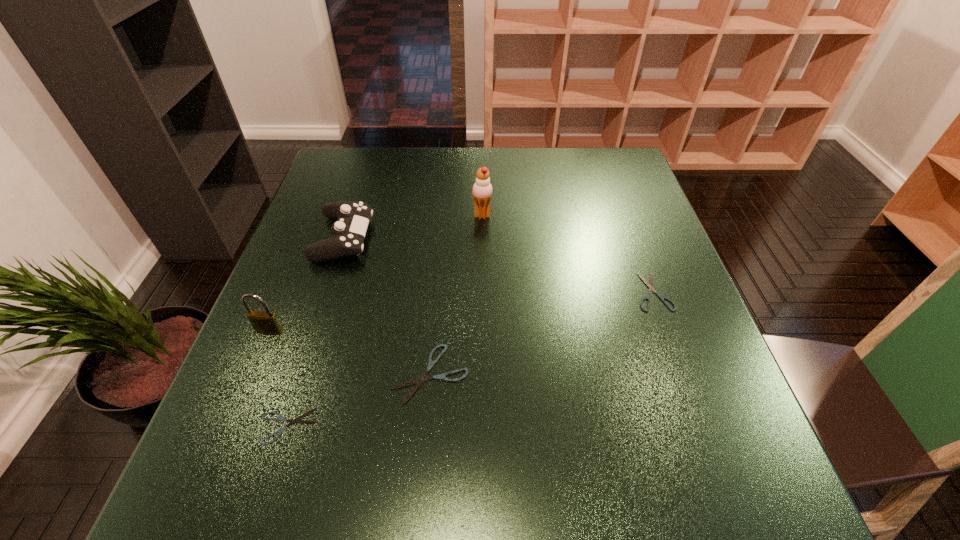
Locate an element on the screen. control situated at the left edge is located at coordinates (352, 217).

In order to click on padlock present at the left edge in this screenshot , I will do `click(266, 322)`.

At what (x,y) coordinates should I click in order to perform the action: click on object that is positioned at the right edge. Please return your answer as a coordinate pair (x, y). The height and width of the screenshot is (540, 960). Looking at the image, I should click on (650, 286).

What are the coordinates of `object that is at the near left corner` in the screenshot? It's located at pyautogui.click(x=291, y=421).

Where is `vacant space at the far edge of the desktop`? The height and width of the screenshot is (540, 960). vacant space at the far edge of the desktop is located at coordinates (492, 153).

Locate an element on the screen. The height and width of the screenshot is (540, 960). vacant space at the near edge of the desktop is located at coordinates (539, 426).

In the image, there is a desktop. Where is `free space at the left edge`? This screenshot has width=960, height=540. free space at the left edge is located at coordinates (288, 265).

Where is `vacant space at the right edge of the desktop`? The width and height of the screenshot is (960, 540). vacant space at the right edge of the desktop is located at coordinates (600, 205).

This screenshot has width=960, height=540. I want to click on free spot at the far left corner of the desktop, so click(x=341, y=171).

In the image, there is a desktop. At what (x,y) coordinates should I click in order to perform the action: click on vacant space at the far right corner. Please return your answer as a coordinate pair (x, y). Looking at the image, I should click on (609, 177).